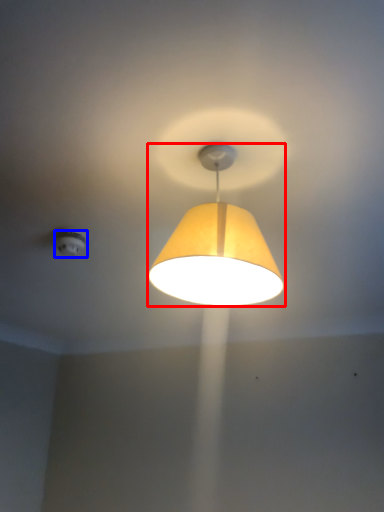
Question: Which object is further to the camera taking this photo, lamp (highlighted by a red box) or lighting (highlighted by a blue box)?

Choices:
 (A) lamp
 (B) lighting

Answer: (B)